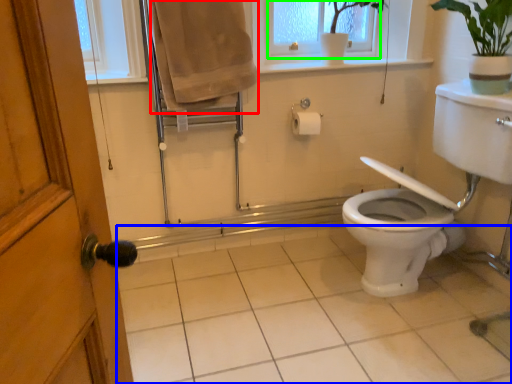
Question: Which object is the closest to the bath towel (highlighted by a red box)? Choose among these: plain (highlighted by a blue box) or window frame (highlighted by a green box).

Choices:
 (A) plain
 (B) window frame

Answer: (B)